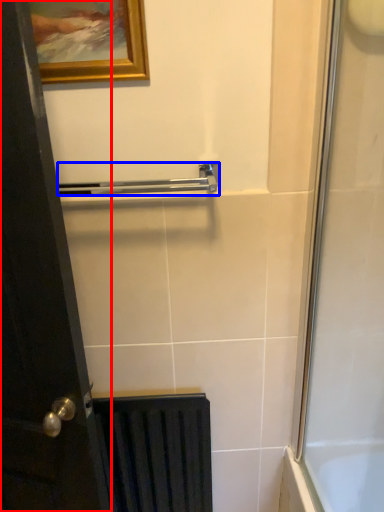
Question: Among these objects, which one is nearest to the camera, door (highlighted by a red box) or towel bar (highlighted by a blue box)?

Choices:
 (A) door
 (B) towel bar

Answer: (A)